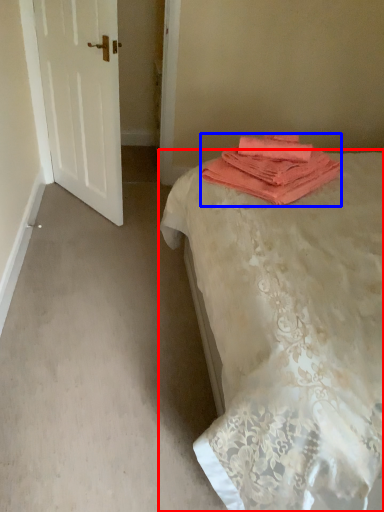
Question: Among these objects, which one is nearest to the camera, bed (highlighted by a red box) or towel (highlighted by a blue box)?

Choices:
 (A) bed
 (B) towel

Answer: (A)